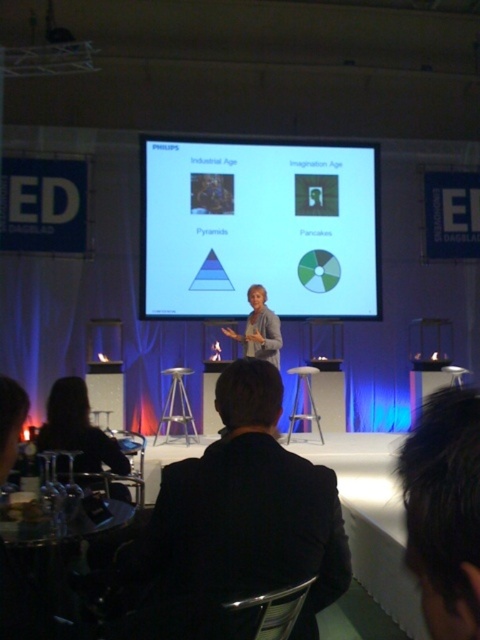
Can you confirm if silver metallic stool at center is wider than metallic stool at center?

Yes.

Does silver metallic stool at center appear under metallic stool at center?

Yes, silver metallic stool at center is below metallic stool at center.

The height and width of the screenshot is (640, 480). What do you see at coordinates (177, 404) in the screenshot?
I see `silver metallic stool at center` at bounding box center [177, 404].

Where is `silver metallic stool at center`? This screenshot has width=480, height=640. silver metallic stool at center is located at coordinates (177, 404).

Can you confirm if black suit at center is positioned below light beige blazer at center?

Correct, black suit at center is located below light beige blazer at center.

Who is more forward, (213, 618) or (251, 316)?

Point (213, 618)

Locate an element on the screen. This screenshot has width=480, height=640. black suit at center is located at coordinates (241, 518).

At what (x,y) coordinates should I click in order to perform the action: click on black suit at center. Please return your answer as a coordinate pair (x, y). This screenshot has height=640, width=480. Looking at the image, I should click on (241, 518).

Can you confirm if black suit at center is positioned above silhouette hair at lower left?

Yes.

Does black suit at center have a larger size compared to silhouette hair at lower left?

Correct, black suit at center is larger in size than silhouette hair at lower left.

Locate an element on the screen. black suit at center is located at coordinates (241, 518).

Identify the location of black suit at center. (241, 518).